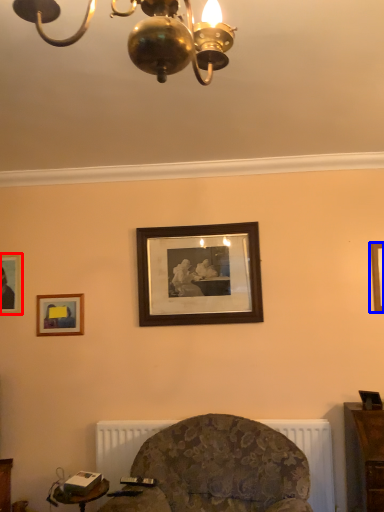
Question: Which of the following is the closest to the observer, picture frame (highlighted by a red box) or picture frame (highlighted by a blue box)?

Choices:
 (A) picture frame
 (B) picture frame

Answer: (B)